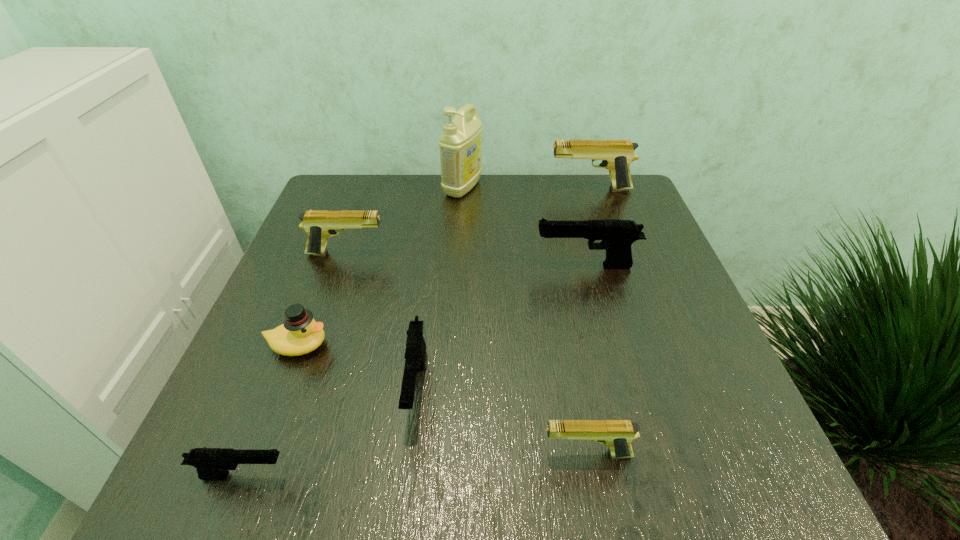
I want to click on the third closest pistol to the farthest pistol, so click(x=415, y=351).

Point out which pistol is positioned as the fifth nearest to the fourth farthest pistol. Please provide its 2D coordinates. Your answer should be formatted as a tuple, i.e. [(x, y)], where the tuple contains the x and y coordinates of a point satisfying the conditions above.

[(616, 155)]

I want to click on tan pistol that is the third nearest to the detergent, so click(x=616, y=434).

Where is `the second closest tan pistol to the biggest tan pistol`? The width and height of the screenshot is (960, 540). the second closest tan pistol to the biggest tan pistol is located at coordinates click(616, 434).

The width and height of the screenshot is (960, 540). Identify the location of the second closest black pistol to the duck. (211, 463).

The height and width of the screenshot is (540, 960). In order to click on black pistol that is the closest to the fourth pistol from right to left in this screenshot , I will do `click(211, 463)`.